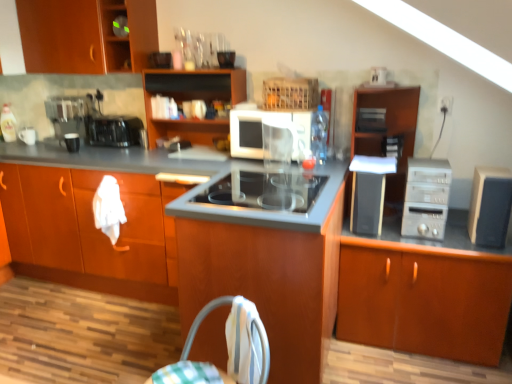
Question: Is clear plastic bottle at center in front of or behind satin silver computer tower at right in the image?

Choices:
 (A) front
 (B) behind

Answer: (B)

Question: From the image's perspective, is clear plastic bottle at center located above or below satin silver computer tower at right?

Choices:
 (A) above
 (B) below

Answer: (A)

Question: Which of these objects is positioned farthest from the satin silver toaster at upper center, which is the fourth appliance in left-to-right order?

Choices:
 (A) white glossy mug at left, placed as the first appliance when sorted from left to right
 (B) black matte speaker at right, the fifth appliance from the left
 (C) wooden cabinet at center, the 3th cabinetry in the right-to-left sequence
 (D) stainless steel cooktop at center
 (E) wooden cabinet at center, positioned as the 6th cabinetry in right-to-left order

Answer: (A)

Question: Estimate the real-world distances between objects in this image. Which object is farther from the wooden cabinet at upper left, which ranks as the 1th cabinetry in left-to-right order?

Choices:
 (A) metallic black toaster at left, arranged as the 1th kitchen appliance when viewed from the back
 (B) black matte mug at left, which is counted as the 2th appliance, starting from the left
 (C) brown wood cabinet at right, placed as the seventh cabinetry when sorted from left to right
 (D) wooden cabinet at center, positioned as the 6th cabinetry in right-to-left order
 (E) wooden cabinet at center, the fifth cabinetry viewed from the left

Answer: (C)